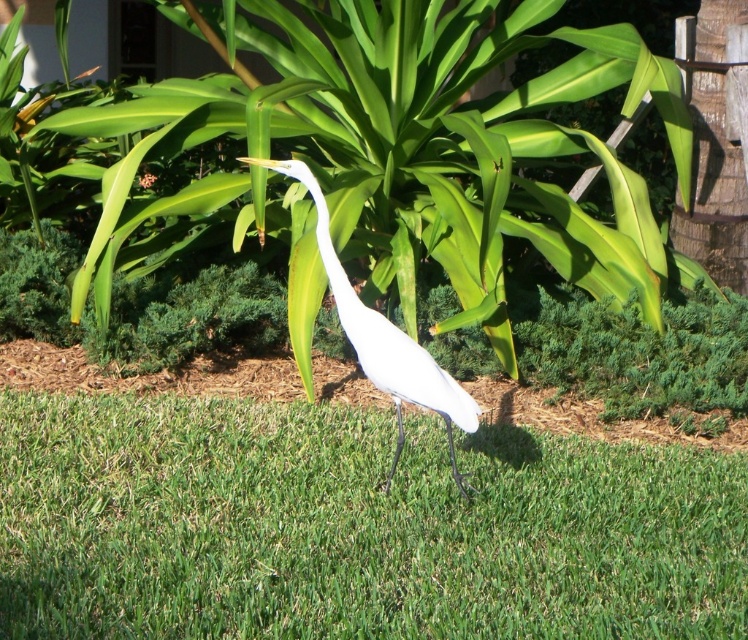
Question: Which object appears farthest from the camera in this image?

Choices:
 (A) green grass at center
 (B) white matte bird at center

Answer: (B)

Question: Does green grass at center appear under white matte bird at center?

Choices:
 (A) no
 (B) yes

Answer: (B)

Question: Among these objects, which one is nearest to the camera?

Choices:
 (A) white matte bird at center
 (B) green grass at center

Answer: (B)

Question: Where is green grass at center located in relation to white matte bird at center in the image?

Choices:
 (A) above
 (B) below

Answer: (B)

Question: Is green grass at center bigger than white matte bird at center?

Choices:
 (A) yes
 (B) no

Answer: (A)